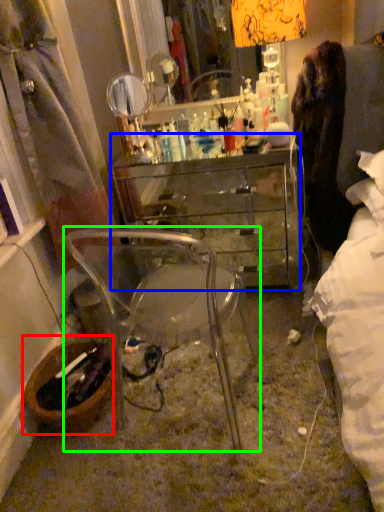
Question: Estimate the real-world distances between objects in this image. Which object is farther from picnic basket (highlighted by a red box), desk (highlighted by a blue box) or chair (highlighted by a green box)?

Choices:
 (A) desk
 (B) chair

Answer: (A)